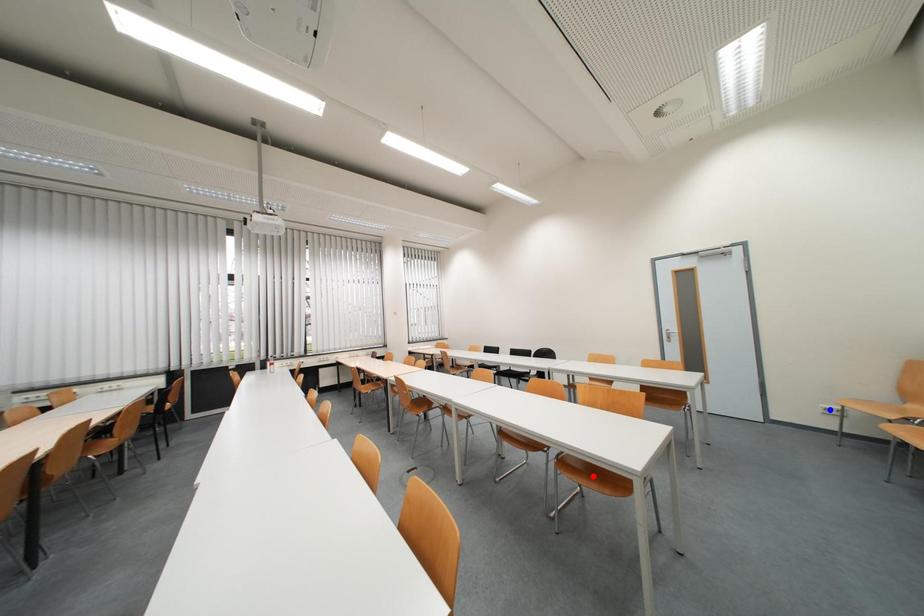
Question: Which of the two points in the image is closer to the camera?

Choices:
 (A) Blue point is closer.
 (B) Red point is closer.

Answer: (B)